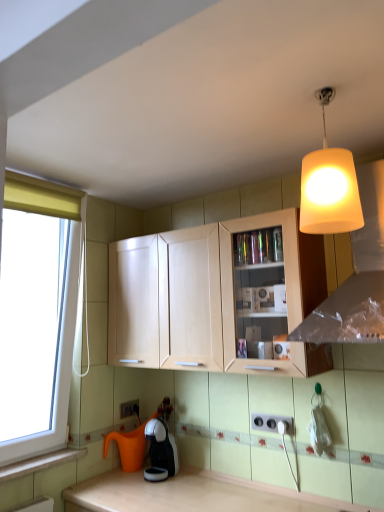
Question: Considering the positions of matte white lampshade at upper right and white plastic electric outlet at lower center, which is the 1th electric outlet from front to back, in the image, is matte white lampshade at upper right taller or shorter than white plastic electric outlet at lower center, which is the 1th electric outlet from front to back,?

Choices:
 (A) short
 (B) tall

Answer: (B)

Question: Based on their positions, is matte white lampshade at upper right located to the left or right of white plastic electric outlet at lower center, which is counted as the second electric outlet, starting from the back?

Choices:
 (A) right
 (B) left

Answer: (A)

Question: Considering the real-world distances, which object is closest to the light wood cabinet at center?

Choices:
 (A) matte white lampshade at upper right
 (B) white plastic electric outlet at lower center, the second electric outlet in the bottom-to-top sequence
 (C) wooden at lower left
 (D) matte white lampshade at upper right
 (E) black glossy coffee machine at lower center

Answer: (A)

Question: Estimate the real-world distances between objects in this image. Which object is closer to the wooden at lower left?

Choices:
 (A) light wood cabinet at center
 (B) matte white lampshade at upper right
 (C) white plastic electric outlet at lower center, acting as the second electric outlet starting from the left
 (D) white plastic electric outlet at lower center, marked as the 2th electric outlet in a top-to-bottom arrangement
 (E) black glossy coffee machine at lower center

Answer: (E)